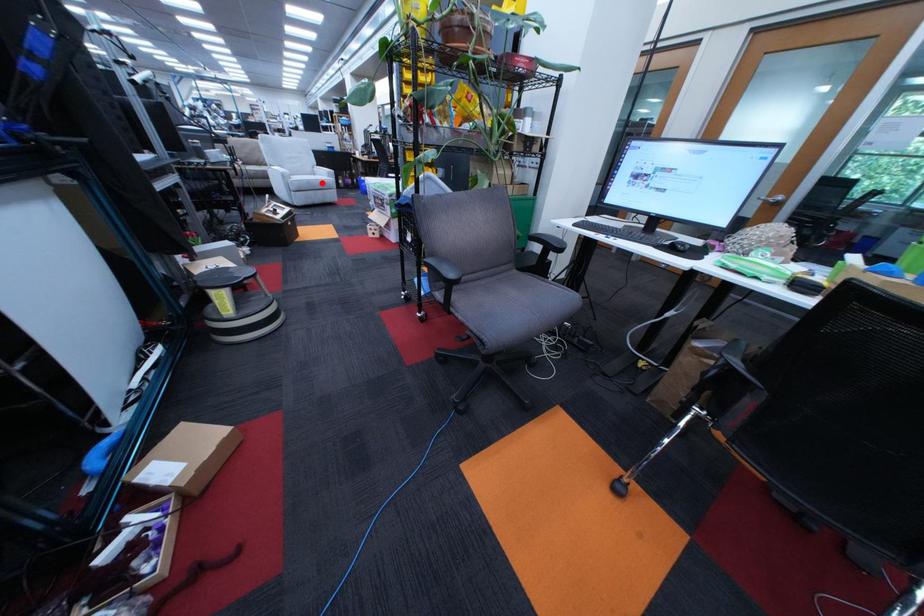
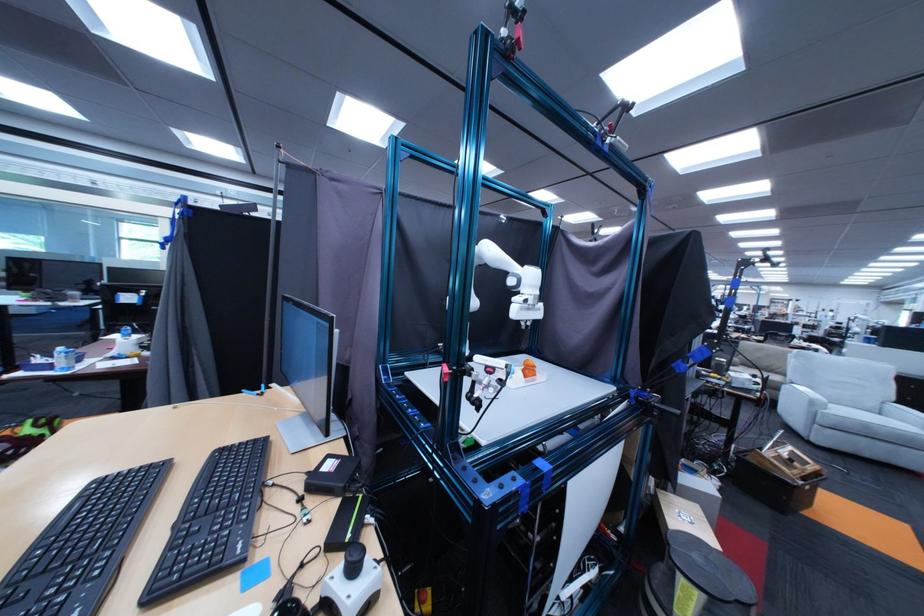
In the second image, find the point that corresponds to the highlighted location in the first image.

(879, 426)